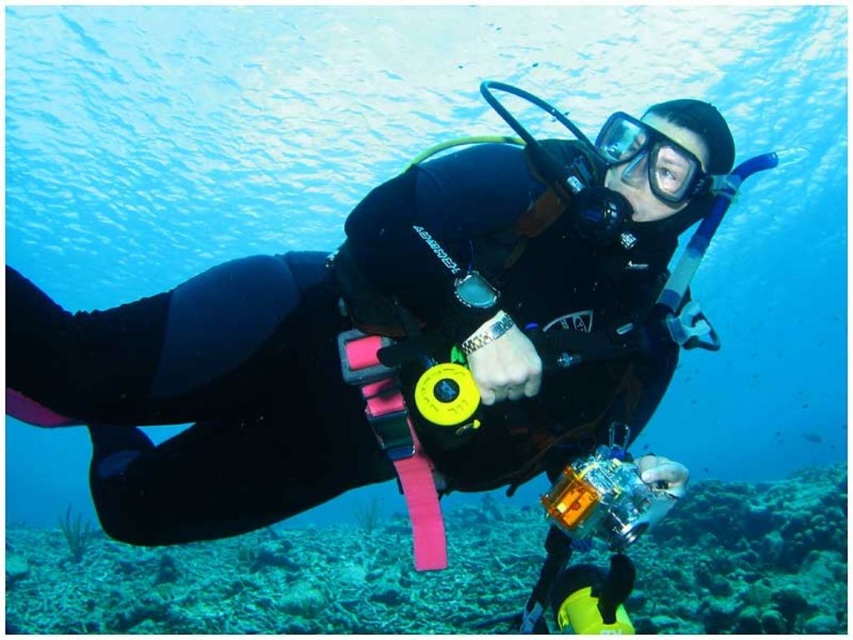
Is the position of transparent blue water at center less distant than that of rough coral reef at lower center?

Yes.

How much distance is there between transparent blue water at center and rough coral reef at lower center?

7.42 meters

The height and width of the screenshot is (640, 853). In order to click on transparent blue water at center in this screenshot , I will do `click(430, 145)`.

At what (x,y) coordinates should I click in order to perform the action: click on transparent blue water at center. Please return your answer as a coordinate pair (x, y). The width and height of the screenshot is (853, 640). Looking at the image, I should click on (430, 145).

Is rough coral reef at lower center closer to the viewer compared to transparent rubber goggles at center?

That is False.

Looking at this image, can you confirm if rough coral reef at lower center is positioned above transparent rubber goggles at center?

Incorrect, rough coral reef at lower center is not positioned above transparent rubber goggles at center.

Is point (350, 576) farther from viewer compared to point (682, 204)?

Yes, it is.

Identify the location of rough coral reef at lower center. Image resolution: width=853 pixels, height=640 pixels. (277, 580).

Is point (718, 429) positioned in front of point (654, 182)?

That is False.

Does transparent blue water at center have a lesser width compared to transparent rubber goggles at center?

In fact, transparent blue water at center might be wider than transparent rubber goggles at center.

Where is `transparent blue water at center`? This screenshot has height=640, width=853. transparent blue water at center is located at coordinates (430, 145).